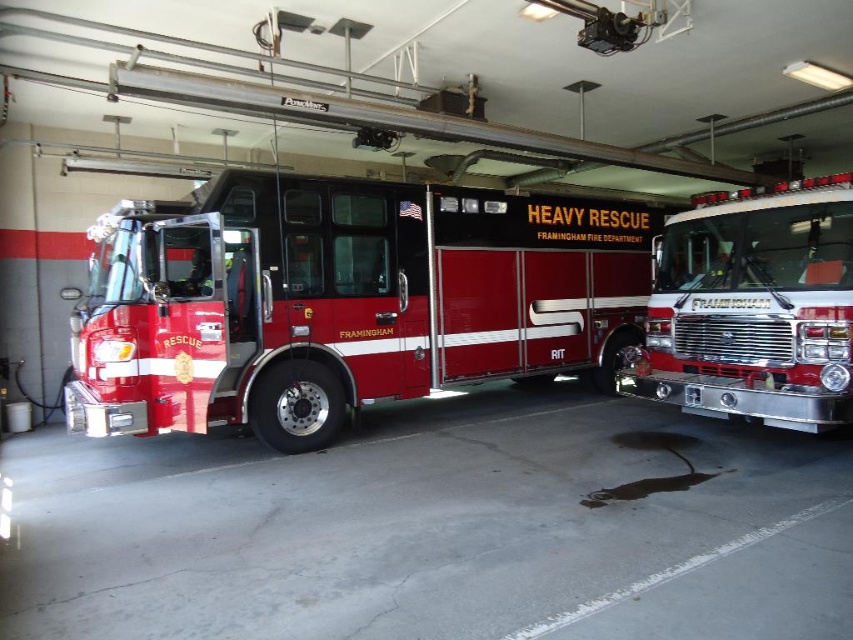
Question: Which point is farther from the camera taking this photo?

Choices:
 (A) (735, 404)
 (B) (320, 220)

Answer: (B)

Question: Is shiny red fire truck at center wider than shiny chrome fire truck at right?

Choices:
 (A) yes
 (B) no

Answer: (B)

Question: Is shiny red fire truck at center positioned behind shiny chrome fire truck at right?

Choices:
 (A) no
 (B) yes

Answer: (B)

Question: Which of the following is the farthest from the observer?

Choices:
 (A) (653, 323)
 (B) (254, 326)

Answer: (A)

Question: From the image, what is the correct spatial relationship of shiny red fire truck at center in relation to shiny chrome fire truck at right?

Choices:
 (A) below
 (B) above

Answer: (A)